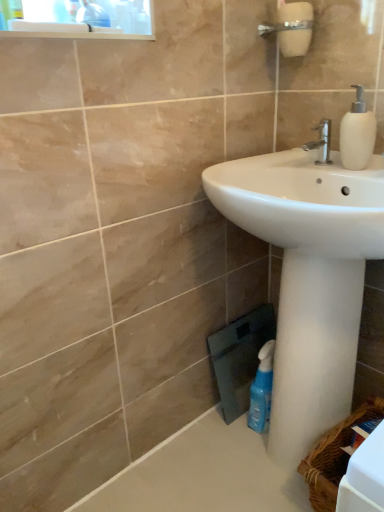
Find the location of a particular element. free space to the left of silver metallic faucet at upper center is located at coordinates (273, 166).